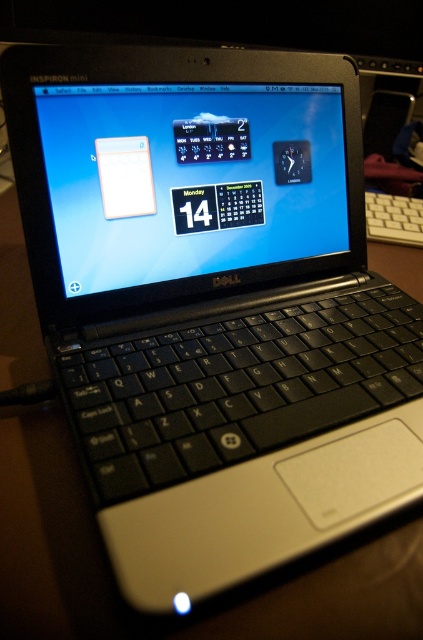
This screenshot has width=423, height=640. What do you see at coordinates (191, 179) in the screenshot? I see `matte plastic screen at center` at bounding box center [191, 179].

Is point (164, 160) more distant than point (375, 202)?

No, it is in front of (375, 202).

Who is more forward, (315, 220) or (367, 198)?

Point (315, 220) is more forward.

Locate an element on the screen. Image resolution: width=423 pixels, height=640 pixels. matte plastic screen at center is located at coordinates (191, 179).